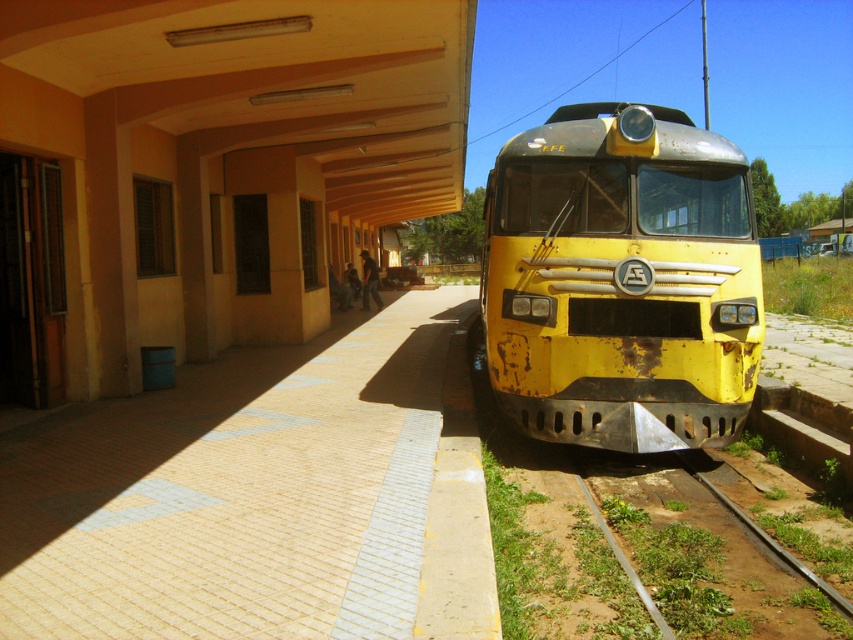
Question: Which point is farther to the camera?

Choices:
 (A) (209, 621)
 (B) (822, 616)
 (C) (730, 289)

Answer: (C)

Question: Which point is farther to the camera?

Choices:
 (A) brick pavement at center
 (B) green grassy track at lower right

Answer: (B)

Question: Estimate the real-world distances between objects in this image. Which object is farther from the green grassy track at lower right?

Choices:
 (A) yellow matte train at center
 (B) brick pavement at center

Answer: (B)

Question: Can you confirm if brick pavement at center is smaller than green grassy track at lower right?

Choices:
 (A) no
 (B) yes

Answer: (A)

Question: Can you confirm if brick pavement at center is wider than green grassy track at lower right?

Choices:
 (A) no
 (B) yes

Answer: (B)

Question: Does brick pavement at center appear over yellow matte train at center?

Choices:
 (A) no
 (B) yes

Answer: (A)